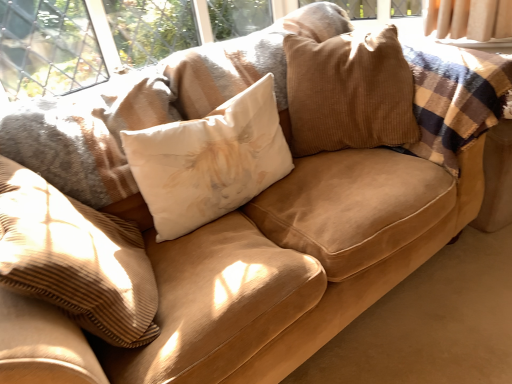
Question: Is white cotton pillow at center, which is counted as the second pillow, starting from the left, wider than white corduroy pillow at center, the 1th pillow in the left-to-right sequence?

Choices:
 (A) yes
 (B) no

Answer: (B)

Question: Could you tell me if white cotton pillow at center, which is counted as the second pillow, starting from the left, is facing white corduroy pillow at center, the 1th pillow in the left-to-right sequence?

Choices:
 (A) yes
 (B) no

Answer: (B)

Question: Is white cotton pillow at center, positioned as the second pillow in right-to-left order, completely or partially outside of white corduroy pillow at center, acting as the third pillow starting from the right?

Choices:
 (A) yes
 (B) no

Answer: (A)

Question: From a real-world perspective, is white cotton pillow at center, positioned as the second pillow in right-to-left order, over white corduroy pillow at center, acting as the third pillow starting from the right?

Choices:
 (A) yes
 (B) no

Answer: (B)

Question: From the image's perspective, would you say white cotton pillow at center, positioned as the second pillow in right-to-left order, is shown under white corduroy pillow at center, the 1th pillow in the left-to-right sequence?

Choices:
 (A) yes
 (B) no

Answer: (B)

Question: Considering the positions of white cotton pillow at center, positioned as the second pillow in right-to-left order, and corduroy pillow at center, which is the 3th pillow in left-to-right order, in the image, is white cotton pillow at center, positioned as the second pillow in right-to-left order, wider or thinner than corduroy pillow at center, which is the 3th pillow in left-to-right order,?

Choices:
 (A) thin
 (B) wide

Answer: (A)

Question: From a real-world perspective, is white cotton pillow at center, which is counted as the second pillow, starting from the left, positioned above or below corduroy pillow at center, which ranks as the first pillow in right-to-left order?

Choices:
 (A) below
 (B) above

Answer: (A)

Question: Based on their positions, is white cotton pillow at center, which is counted as the second pillow, starting from the left, located to the left or right of corduroy pillow at center, which ranks as the first pillow in right-to-left order?

Choices:
 (A) right
 (B) left

Answer: (B)

Question: Do you think white cotton pillow at center, positioned as the second pillow in right-to-left order, is within corduroy pillow at center, which is the 3th pillow in left-to-right order, or outside of it?

Choices:
 (A) outside
 (B) inside

Answer: (A)

Question: Considering the positions of white cotton pillow at center, which is counted as the second pillow, starting from the left, and white corduroy pillow at center, the 1th pillow in the left-to-right sequence, in the image, is white cotton pillow at center, which is counted as the second pillow, starting from the left, taller or shorter than white corduroy pillow at center, the 1th pillow in the left-to-right sequence,?

Choices:
 (A) short
 (B) tall

Answer: (A)

Question: Based on their positions, is white cotton pillow at center, positioned as the second pillow in right-to-left order, located to the left or right of white corduroy pillow at center, the 1th pillow in the left-to-right sequence?

Choices:
 (A) right
 (B) left

Answer: (A)

Question: Considering the positions of white cotton pillow at center, positioned as the second pillow in right-to-left order, and white corduroy pillow at center, acting as the third pillow starting from the right, in the image, is white cotton pillow at center, positioned as the second pillow in right-to-left order, wider or thinner than white corduroy pillow at center, acting as the third pillow starting from the right,?

Choices:
 (A) wide
 (B) thin

Answer: (B)

Question: From the image's perspective, relative to white corduroy pillow at center, the 1th pillow in the left-to-right sequence, is white cotton pillow at center, positioned as the second pillow in right-to-left order, above or below?

Choices:
 (A) above
 (B) below

Answer: (A)

Question: From a real-world perspective, is corduroy pillow at center, which is the 3th pillow in left-to-right order, positioned above or below white cotton pillow at center, positioned as the second pillow in right-to-left order?

Choices:
 (A) above
 (B) below

Answer: (A)

Question: Is point (331, 148) positioned closer to the camera than point (138, 160)?

Choices:
 (A) closer
 (B) farther

Answer: (B)